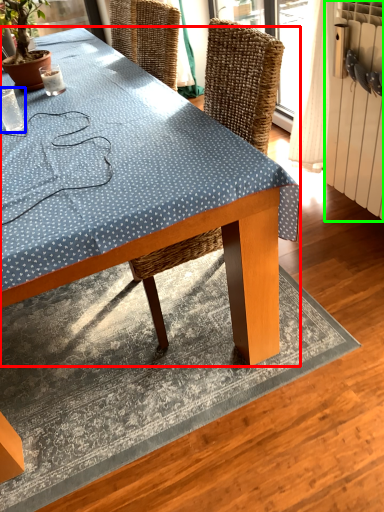
Question: Estimate the real-world distances between objects in this image. Which object is farther from desk (highlighted by a red box), coffee cup (highlighted by a blue box) or radiator (highlighted by a green box)?

Choices:
 (A) coffee cup
 (B) radiator

Answer: (B)